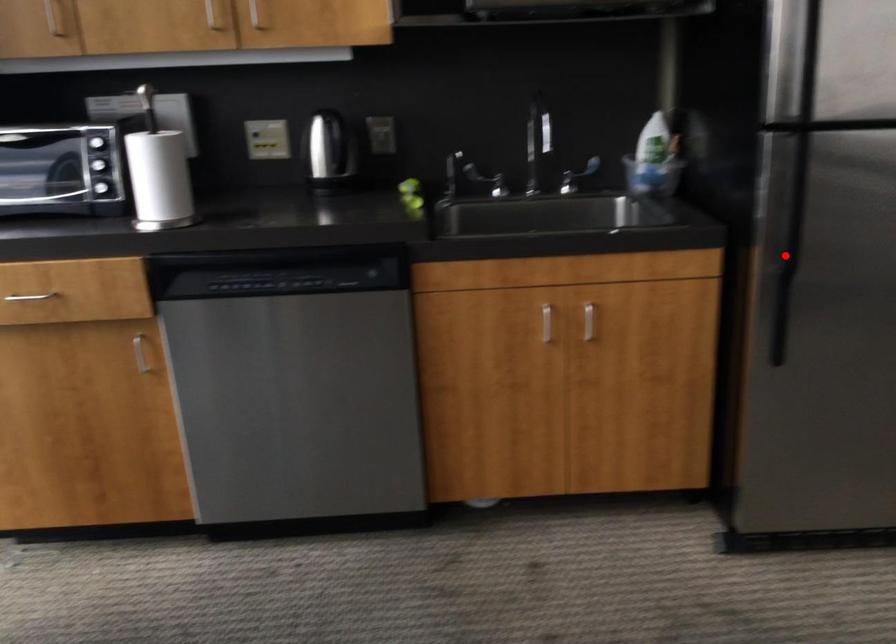
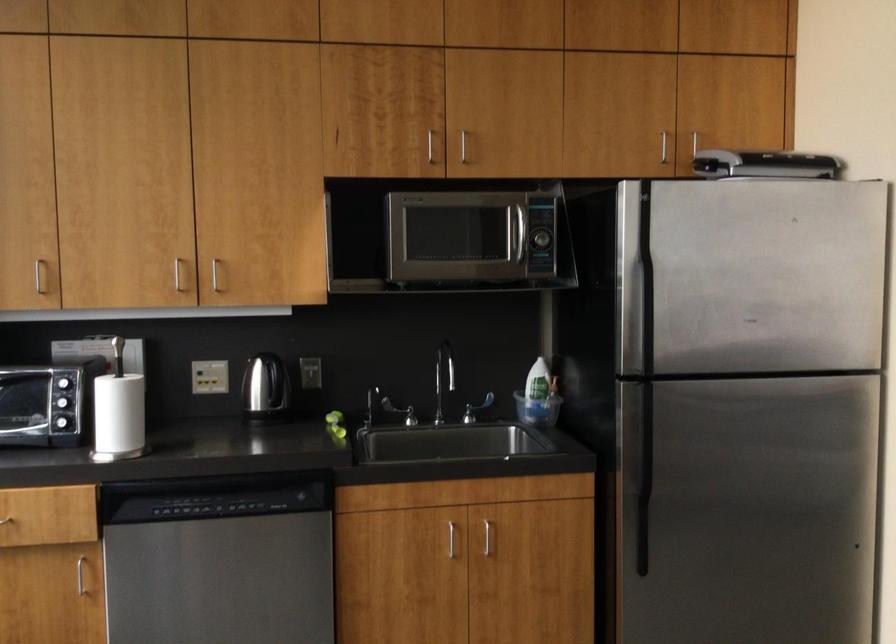
The point at the highlighted location is marked in the first image. Where is the corresponding point in the second image?

(643, 480)